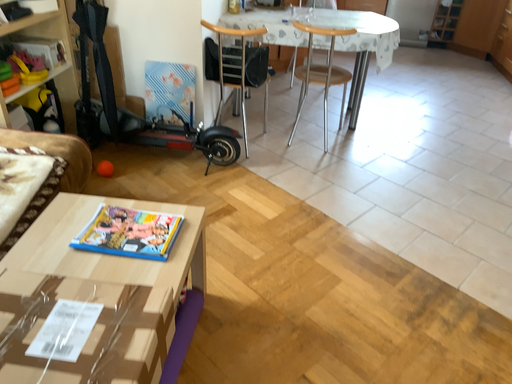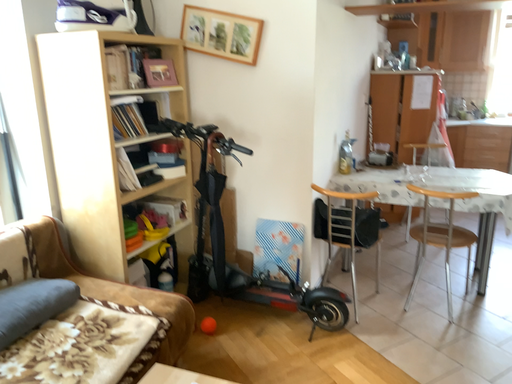
Question: Which way did the camera rotate in the video?

Choices:
 (A) rotated downward
 (B) rotated upward

Answer: (B)